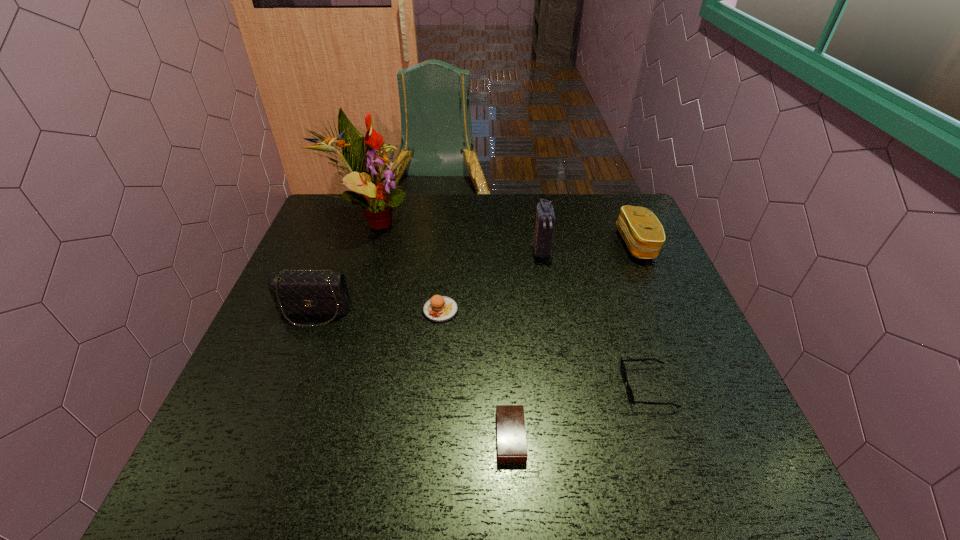
Locate which object is the sixth closest to the nearest object. Please provide its 2D coordinates. Your answer should be formatted as a tuple, i.e. [(x, y)], where the tuple contains the x and y coordinates of a point satisfying the conditions above.

[(363, 157)]

Where is `object that can be found as the third closest to the fourth object from right to left`? object that can be found as the third closest to the fourth object from right to left is located at coordinates (295, 293).

Identify which clutch bag is the nearest to the nearest object. Please provide its 2D coordinates. Your answer should be formatted as a tuple, i.e. [(x, y)], where the tuple contains the x and y coordinates of a point satisfying the conditions above.

[(295, 293)]

The height and width of the screenshot is (540, 960). Find the location of `the third closest clutch bag to the nearest object`. the third closest clutch bag to the nearest object is located at coordinates (642, 232).

The width and height of the screenshot is (960, 540). Identify the location of vacant space that satisfies the following two spatial constraints: 1. on the front-facing side of the tallest object; 2. on the right side of the fifth tallest object. (341, 310).

This screenshot has width=960, height=540. In order to click on vacant space that satisfies the following two spatial constraints: 1. with the zip open on the second clutch bag from left to right; 2. on the front face of the alarm clock in this screenshot , I will do `click(572, 437)`.